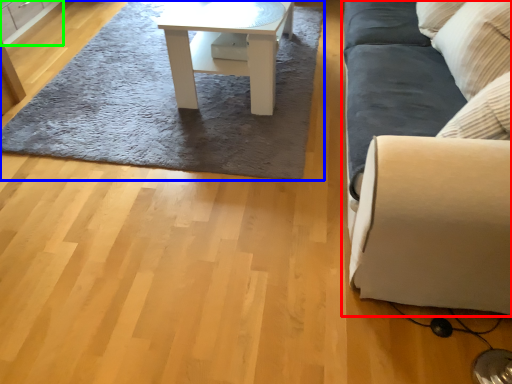
Question: Considering the real-world distances, which object is closest to studio couch (highlighted by a red box)? mat (highlighted by a blue box) or cabinetry (highlighted by a green box).

Choices:
 (A) mat
 (B) cabinetry

Answer: (A)